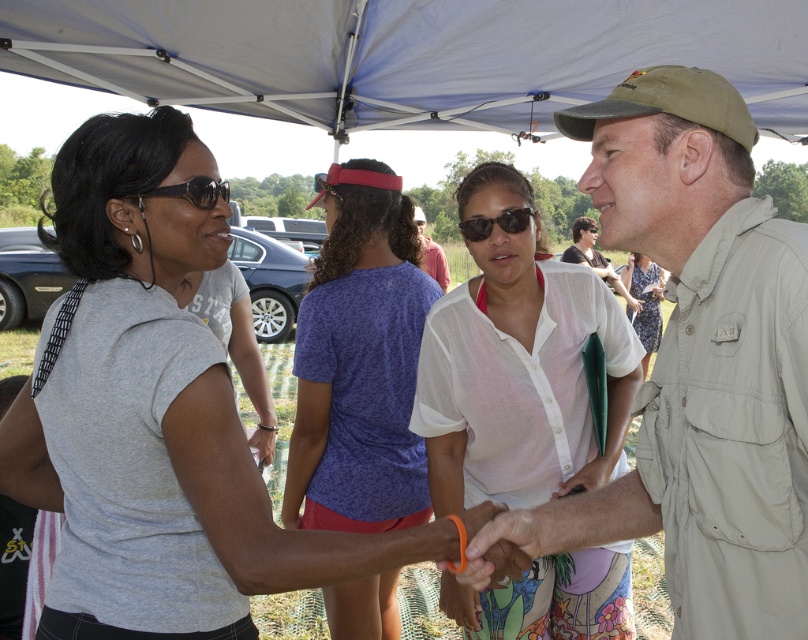
Does point (47, 493) lie behind point (626, 276)?

No, it is in front of (626, 276).

Between matte gray t-shirt at center and white cotton dress at center, which one has more height?

white cotton dress at center

Where is `matte gray t-shirt at center`? This screenshot has width=808, height=640. matte gray t-shirt at center is located at coordinates (158, 417).

Between point (53, 372) and point (709, 70), which one is positioned behind?

The point (53, 372) is more distant.

Can you confirm if matte gray t-shirt at center is positioned below khaki fabric shirt at center?

Indeed, matte gray t-shirt at center is positioned under khaki fabric shirt at center.

The height and width of the screenshot is (640, 808). Describe the element at coordinates (158, 417) in the screenshot. I see `matte gray t-shirt at center` at that location.

You are a GUI agent. You are given a task and a screenshot of the screen. Output one action in this format:
    pyautogui.click(x=<x>, y=<y>)
    Task: Click on the matte gray t-shirt at center
    
    Given the screenshot: What is the action you would take?
    pyautogui.click(x=158, y=417)

This screenshot has height=640, width=808. What do you see at coordinates (158, 417) in the screenshot?
I see `matte gray t-shirt at center` at bounding box center [158, 417].

Between matte gray t-shirt at center and white cotton shirt at center, which one is positioned higher?

white cotton shirt at center is above.

Identify the location of matte gray t-shirt at center. The image size is (808, 640). (158, 417).